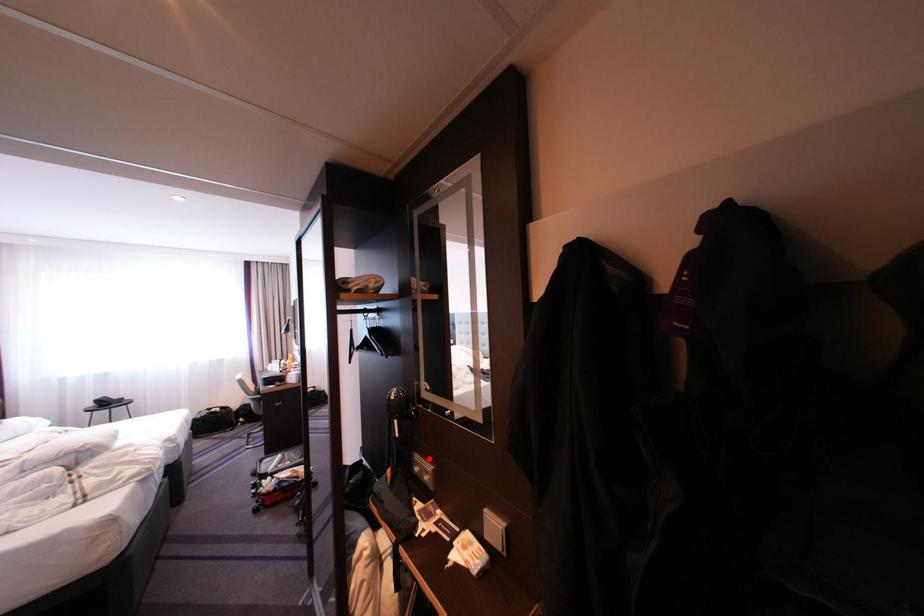
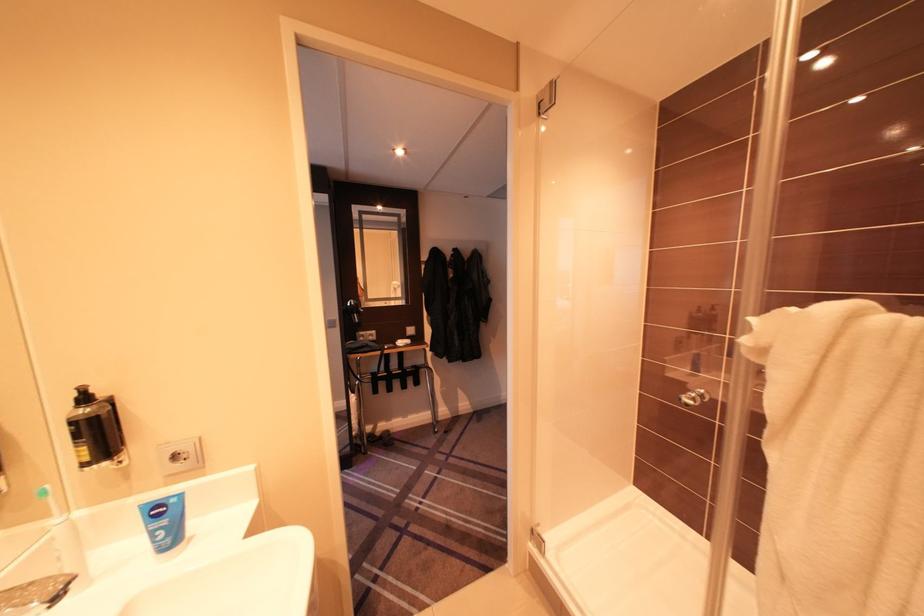
Question: A red point is marked in image1. In image2, is the corresponding 3D point closer to the camera or farther? Reply with the corresponding letter.

Choices:
 (A) The corresponding 3D point is closer.
 (B) The corresponding 3D point is farther.

Answer: (A)